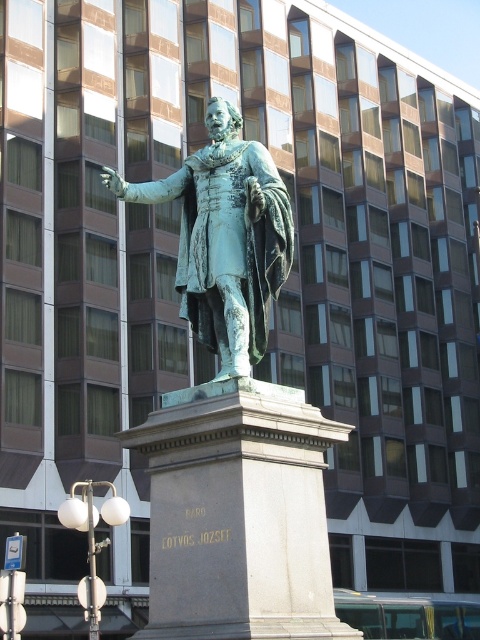
Between point (309, 502) and point (223, 307), which one is positioned in front?

Point (309, 502) is more forward.

Which of these two, green patina statue at center or green patina bronze statue at center, stands taller?

With more height is green patina bronze statue at center.

Does point (262, 276) come closer to viewer compared to point (208, 212)?

Yes.

Find the location of a particular element. green patina statue at center is located at coordinates (233, 419).